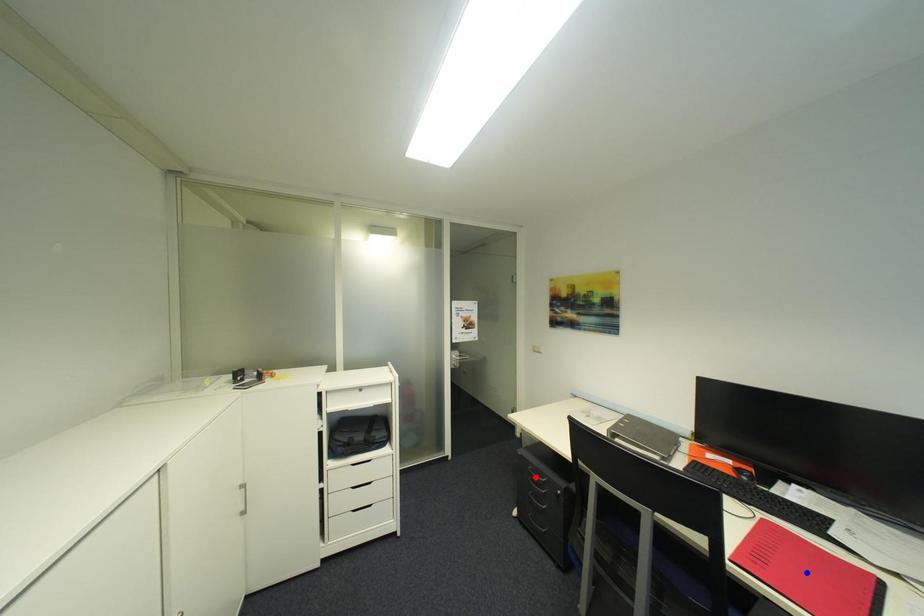
Question: In the image, two points are highlighted. Which point is nearer to the camera? Reply with the corresponding letter.

Choices:
 (A) blue point
 (B) red point

Answer: (A)